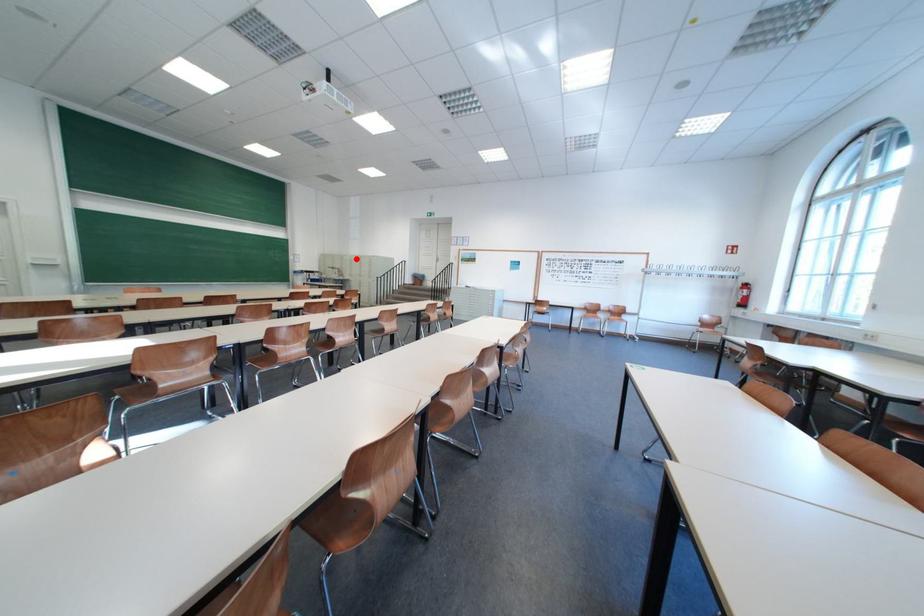
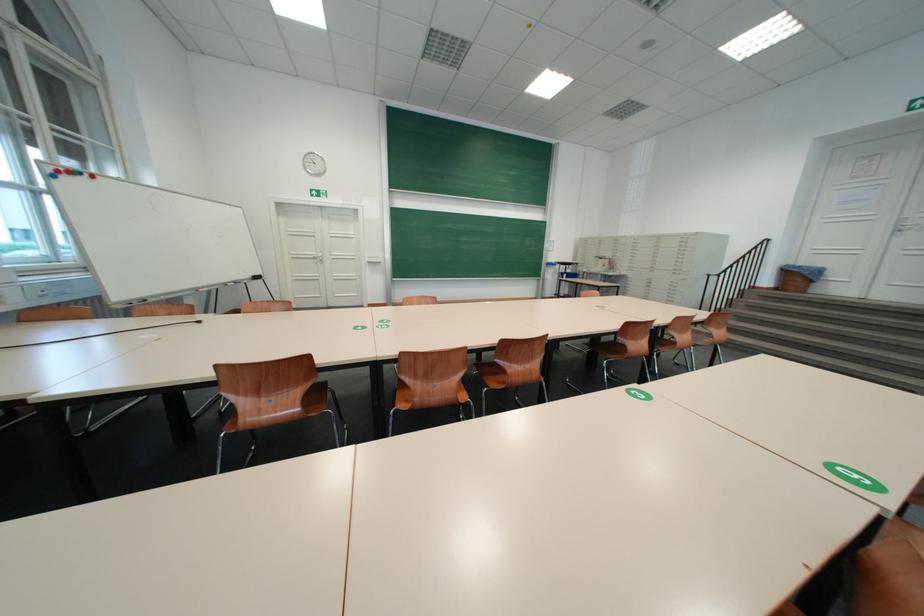
Question: I am providing you with two images of the same scene from different viewpoints. In image1, a red point is highlighted. Considering the same 3D point in image2, which of the following is correct?

Choices:
 (A) It is closer
 (B) It is farther

Answer: (B)